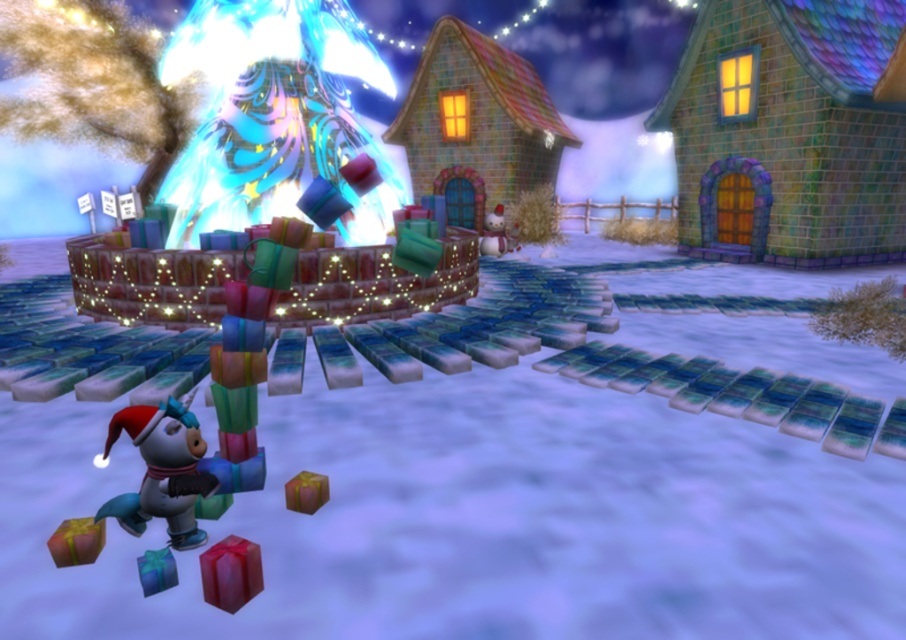
Question: Which of the following is the farthest from the observer?

Choices:
 (A) (207, 588)
 (B) (177, 468)

Answer: (B)

Question: Which point appears closest to the camera in this image?

Choices:
 (A) (90, 547)
 (B) (488, 253)
 (C) (295, 492)
 (D) (257, 589)

Answer: (D)

Question: Is shiny red gift at lower center positioned at the back of matte white snowman at center?

Choices:
 (A) yes
 (B) no

Answer: (B)

Question: Is shiny metallic unicorn at lower left below shiny metallic gift at lower left?

Choices:
 (A) no
 (B) yes

Answer: (A)

Question: Is shiny metallic unicorn at lower left smaller than matte brown gift at lower center?

Choices:
 (A) yes
 (B) no

Answer: (B)

Question: Which is farther from the shiny metallic unicorn at lower left?

Choices:
 (A) matte white snowman at center
 (B) white matte snow at center
 (C) matte brown gift at lower center

Answer: (A)